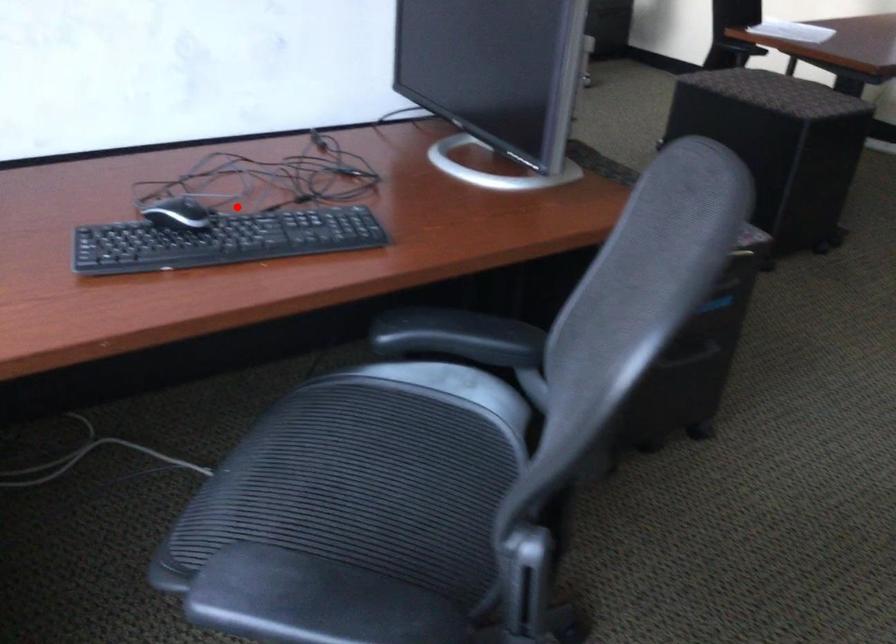
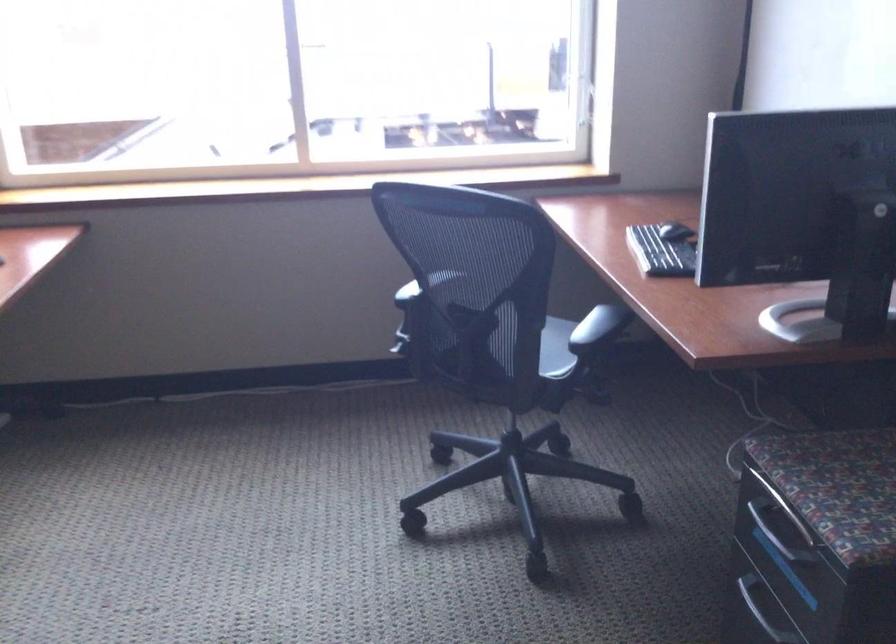
The point at the highlighted location is marked in the first image. Where is the corresponding point in the second image?

(676, 231)